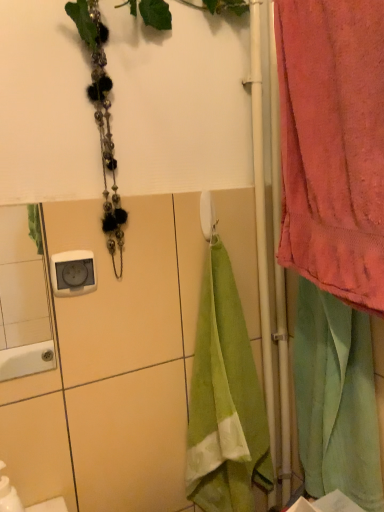
Question: Do you think white glossy electric outlet at upper left is within white glossy mirror at upper left, or outside of it?

Choices:
 (A) outside
 (B) inside

Answer: (A)

Question: From the image's perspective, relative to white glossy mirror at upper left, is white glossy electric outlet at upper left above or below?

Choices:
 (A) above
 (B) below

Answer: (A)

Question: Which object is the closest to the white plastic towel bar at center?

Choices:
 (A) pink cotton towel at right
 (B) white glossy mirror at upper left
 (C) light green velour towel at right
 (D) white glossy electric outlet at upper left

Answer: (D)

Question: Which object is positioned farthest from the light green velour towel at right?

Choices:
 (A) pink cotton towel at right
 (B) white glossy electric outlet at upper left
 (C) white glossy mirror at upper left
 (D) white plastic towel bar at center

Answer: (C)